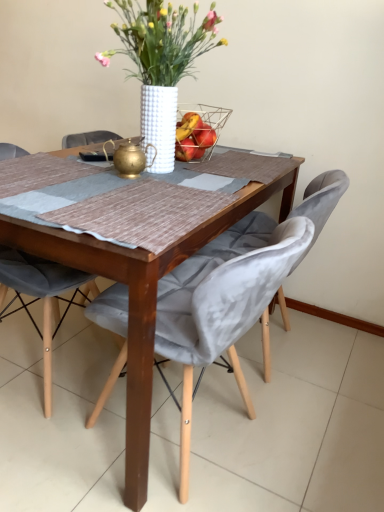
Locate an element on the screen. This screenshot has width=384, height=512. free location above velvet grey chair at center, the 1th chair positioned from the right (from a real-world perspective) is located at coordinates (173, 204).